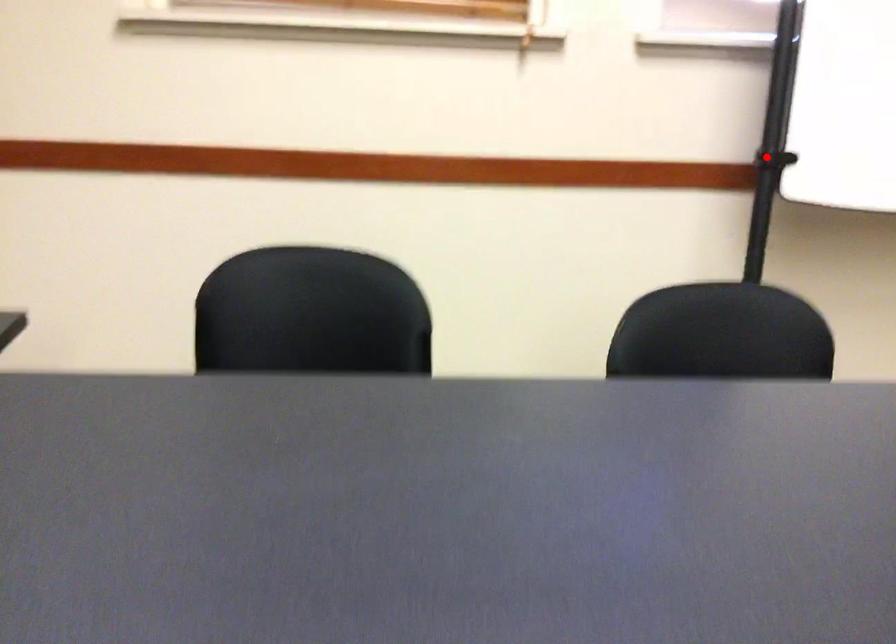
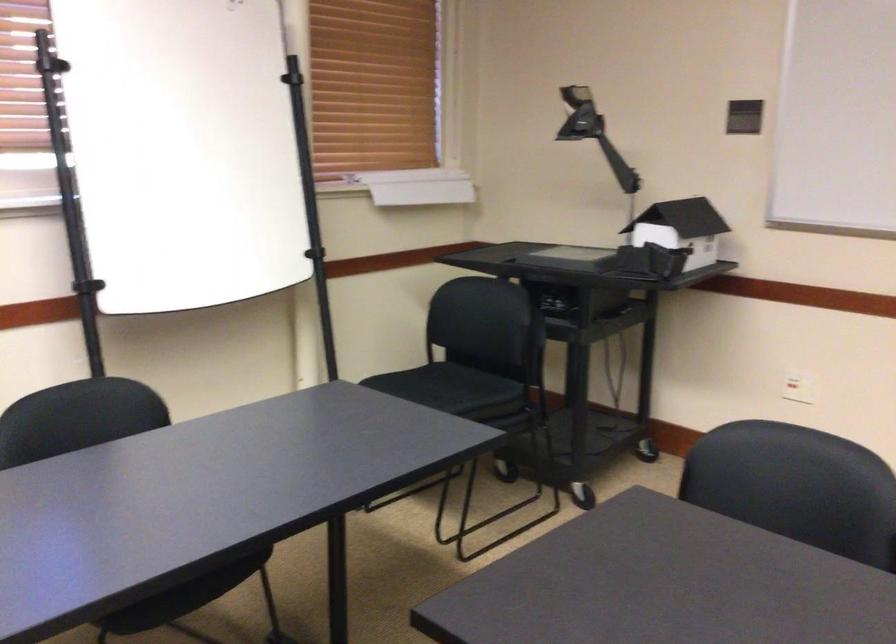
Question: A red point is marked in image1. In image2, is the corresponding 3D point closer to the camera or farther? Reply with the corresponding letter.

Choices:
 (A) The corresponding 3D point is closer.
 (B) The corresponding 3D point is farther.

Answer: (B)